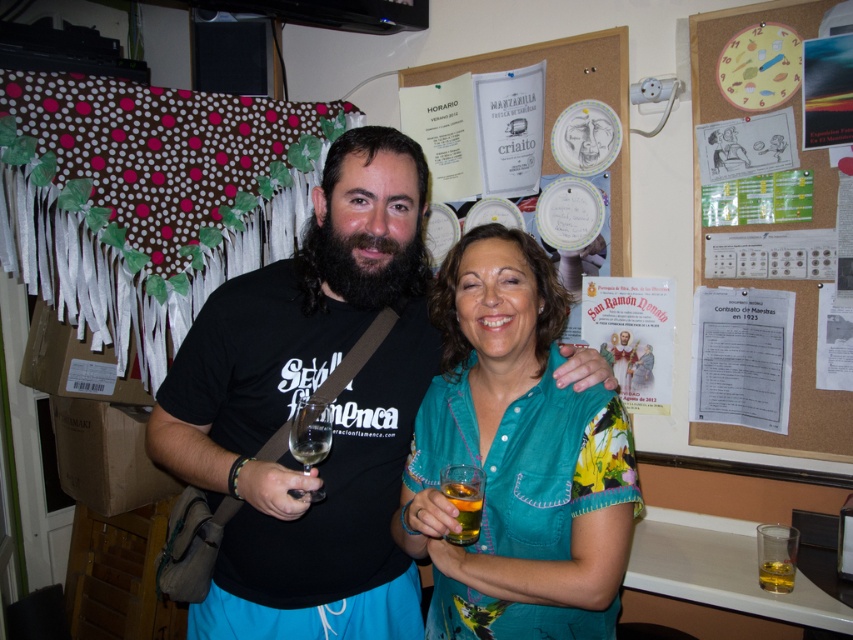
Does teal floral blouse at center appear on the left side of translucent glass at lower right?

Yes, teal floral blouse at center is to the left of translucent glass at lower right.

Between teal floral blouse at center and translucent glass at lower right, which one has less height?

translucent glass at lower right

Identify the location of teal floral blouse at center. The height and width of the screenshot is (640, 853). (515, 458).

You are a GUI agent. You are given a task and a screenshot of the screen. Output one action in this format:
    pyautogui.click(x=<x>, y=<y>)
    Task: Click on the teal floral blouse at center
    
    Given the screenshot: What is the action you would take?
    tap(515, 458)

This screenshot has height=640, width=853. In order to click on wooden corkboard at right in this screenshot , I will do `click(792, 337)`.

Is wooden corkboard at right shorter than white paper poster at right?

No.

You are a GUI agent. You are given a task and a screenshot of the screen. Output one action in this format:
    pyautogui.click(x=<x>, y=<y>)
    Task: Click on the wooden corkboard at right
    Image resolution: width=853 pixels, height=640 pixels.
    Given the screenshot: What is the action you would take?
    pyautogui.click(x=792, y=337)

Where is `wooden corkboard at right`? The height and width of the screenshot is (640, 853). wooden corkboard at right is located at coordinates coord(792,337).

Who is positioned more to the right, black t-shirt at center or translucent glass at lower center?

From the viewer's perspective, translucent glass at lower center appears more on the right side.

Is black t-shirt at center positioned behind translucent glass at lower center?

No, black t-shirt at center is closer to the viewer.

What do you see at coordinates (311, 394) in the screenshot? This screenshot has height=640, width=853. I see `black t-shirt at center` at bounding box center [311, 394].

The image size is (853, 640). Find the location of `black t-shirt at center`. black t-shirt at center is located at coordinates (311, 394).